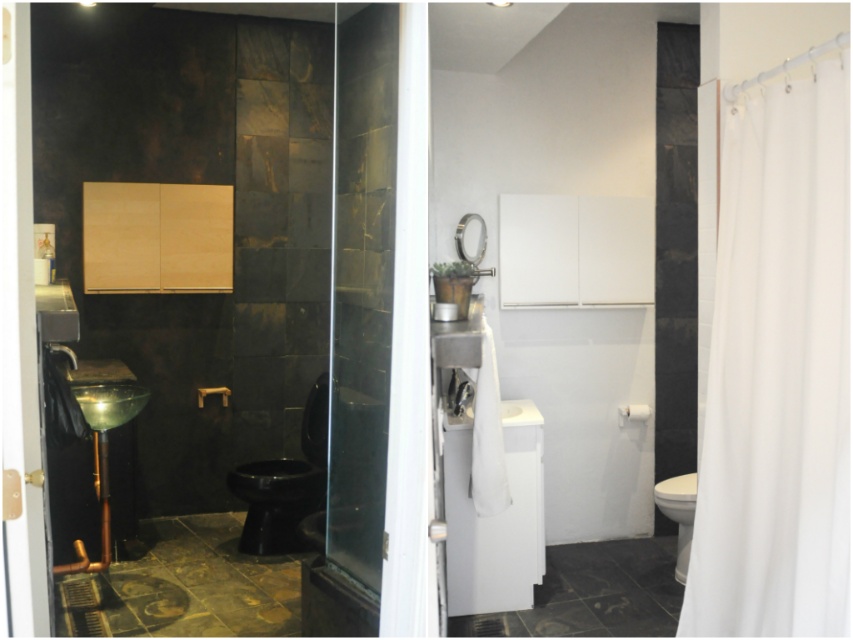
Question: Is transparent glass screen door at center wider than green glass bowl at left?

Choices:
 (A) no
 (B) yes

Answer: (A)

Question: Does white fabric shower curtain at right come behind white glossy toilet bowl at lower right?

Choices:
 (A) no
 (B) yes

Answer: (A)

Question: Which point is closer to the camera taking this photo?

Choices:
 (A) (846, 435)
 (B) (355, 209)
 (C) (119, 413)

Answer: (A)

Question: Is the position of white fabric shower curtain at right more distant than that of green glass bowl at left?

Choices:
 (A) no
 (B) yes

Answer: (A)

Question: Which point is farther from the camera taking this photo?

Choices:
 (A) (730, 310)
 (B) (386, 410)
 (C) (99, 428)

Answer: (C)

Question: Which of these objects is positioned farthest from the white glossy toilet bowl at lower right?

Choices:
 (A) green glass bowl at left
 (B) transparent glass screen door at center
 (C) white fabric shower curtain at right

Answer: (A)